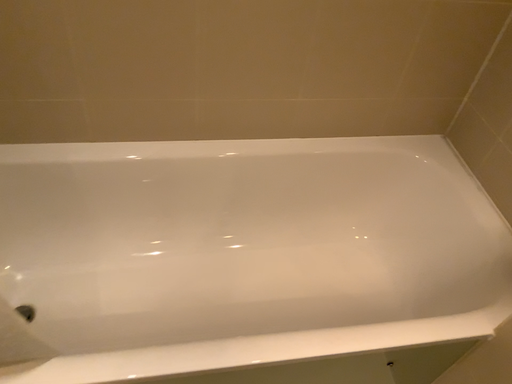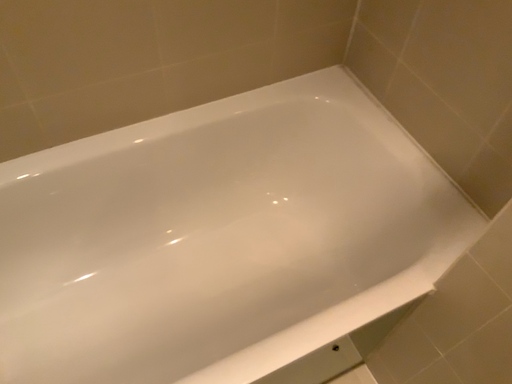
Question: Which way did the camera rotate in the video?

Choices:
 (A) rotated downward
 (B) rotated upward

Answer: (A)